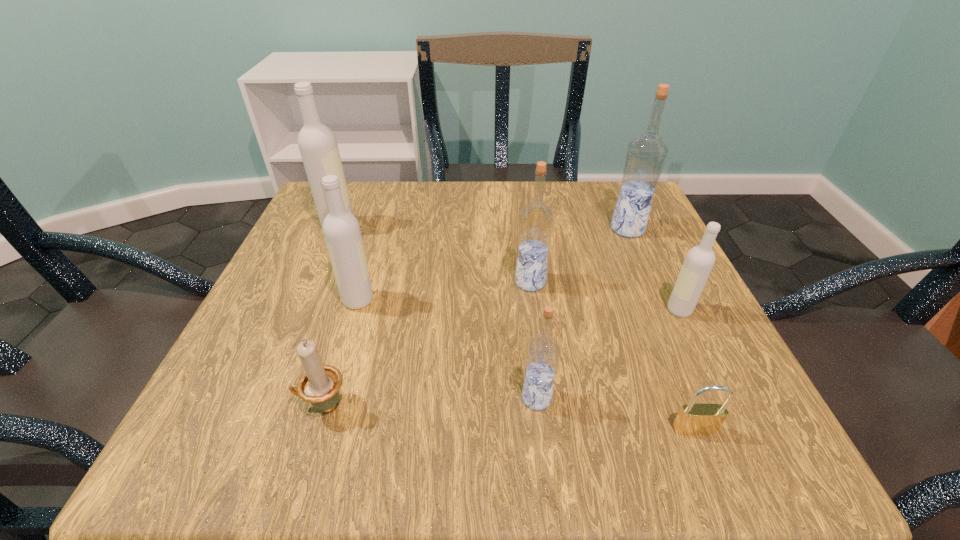
Find the location of `the closest blue vodka relative to the rightmost white vodka`. the closest blue vodka relative to the rightmost white vodka is located at coordinates (646, 155).

Locate an element on the screen. The image size is (960, 540). the closest blue vodka to the second biggest blue vodka is located at coordinates (646, 155).

Identify the location of vacant point that satisfies the following two spatial constraints: 1. on the back side of the smallest white vodka; 2. on the right side of the smallest blue vodka. The width and height of the screenshot is (960, 540). pyautogui.click(x=527, y=310).

Where is `free spot that satisfies the following two spatial constraints: 1. on the front side of the leftmost object; 2. on the right side of the second nearest blue vodka`? The image size is (960, 540). free spot that satisfies the following two spatial constraints: 1. on the front side of the leftmost object; 2. on the right side of the second nearest blue vodka is located at coordinates (315, 282).